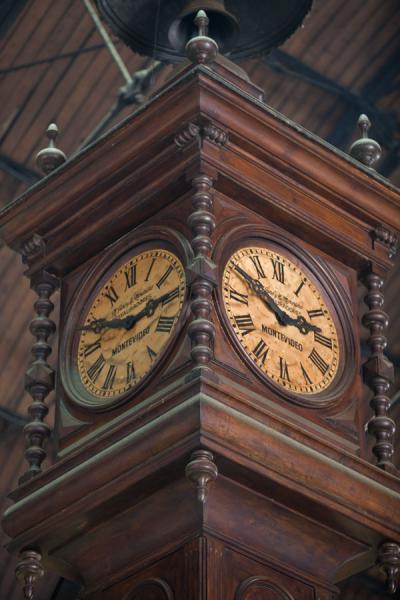
Where is `circular clock frames`? circular clock frames is located at coordinates (254, 237), (136, 242).